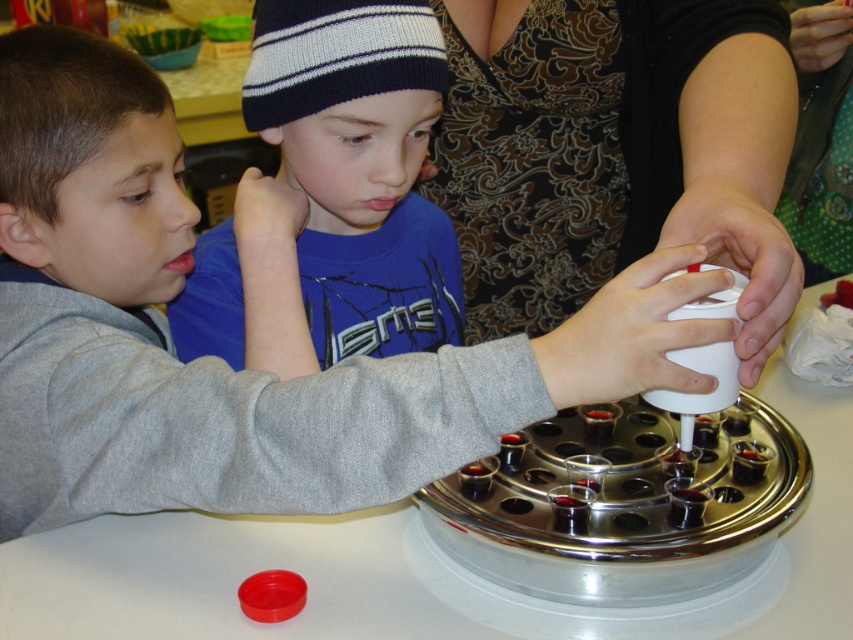
You are a teacher observing the science experiment setup. You need to place a new cup that is narrower than the smooth white cup at center into the area where the patterned fabric dress at upper center is located. Is there enough space for it?

The smooth white cup at center is wider than the patterned fabric dress at upper center. Since the new cup is narrower than the smooth white cup at center, it may still be wider than the space available at the patterned fabric dress at upper center location. Therefore, there might not be enough space.

The children are setting up an experiment. They need to place a blue knit hat at upper center on top of the smooth white cup at center. Will the hat fit over the cup?

The smooth white cup at center has a larger width than the blue knit hat at upper center, so the hat will fit over the cup since it is narrower.

You are a photographer trying to capture a clear shot of both the patterned fabric dress at upper center and the blue knit hat at upper center. Since you can only focus on one object at a time, which object should you focus on to ensure the other is still in the frame?

You should focus on the patterned fabric dress at upper center because it is positioned to the right of the blue knit hat at upper center, so keeping the dress in focus will naturally include the hat in the frame as well.